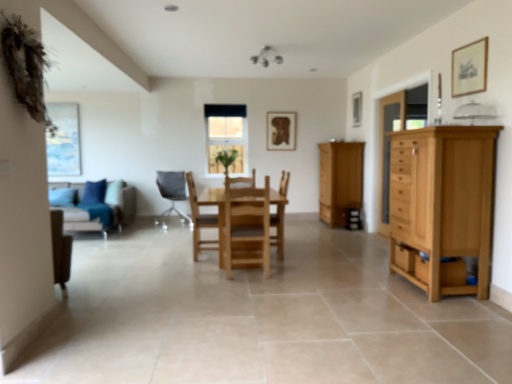
Question: Choose the correct answer: Is wooden picture frame at upper right, arranged as the first picture frame when viewed from the right, inside light brown wooden cupboard at right or outside it?

Choices:
 (A) inside
 (B) outside

Answer: (B)

Question: From their relative heights in the image, would you say wooden picture frame at upper right, arranged as the first picture frame when viewed from the right, is taller or shorter than light brown wooden cupboard at right?

Choices:
 (A) short
 (B) tall

Answer: (A)

Question: Which object is positioned closest to the wooden picture frame at upper center, which is the second picture frame from left to right?

Choices:
 (A) clear glass window at center
 (B) wooden picture frame at upper center, marked as the 1th picture frame in a back-to-front arrangement
 (C) green leafy plant at center
 (D) beige fabric couch at left
 (E) natural wood chair at center, arranged as the first chair when viewed from the front

Answer: (B)

Question: Based on their relative distances, which object is farther from the green leafy plant at center?

Choices:
 (A) wooden drawer at right
 (B) wooden picture frame at upper right, arranged as the first picture frame when viewed from the right
 (C) wooden picture frame at upper center, which is the 1th picture frame in left-to-right order
 (D) clear glass cabinet at right
 (E) light brown wooden cupboard at right

Answer: (B)